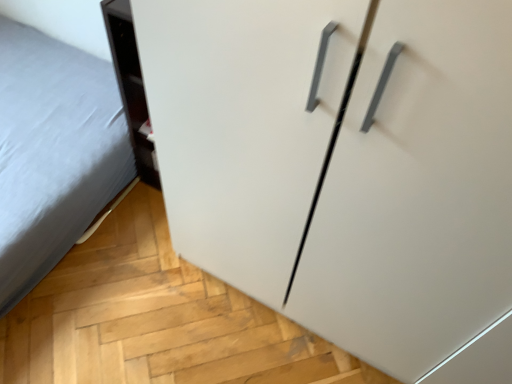
Describe the element at coordinates (53, 152) in the screenshot. I see `matte gray bed at left` at that location.

At what (x,y) coordinates should I click in order to perform the action: click on matte gray bed at left. Please return your answer as a coordinate pair (x, y). Looking at the image, I should click on (53, 152).

The image size is (512, 384). I want to click on matte gray bed at left, so click(x=53, y=152).